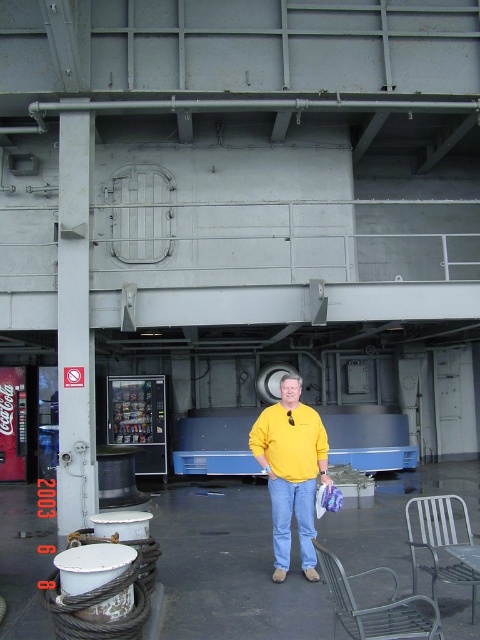
Can you confirm if metallic wire mesh bench at lower right is positioned below blue denim jeans at center?

Incorrect, metallic wire mesh bench at lower right is not positioned below blue denim jeans at center.

Is point (336, 596) in front of point (286, 500)?

Yes.

The width and height of the screenshot is (480, 640). Describe the element at coordinates (375, 605) in the screenshot. I see `metallic wire mesh bench at lower right` at that location.

Where is `metallic wire mesh bench at lower right`? The height and width of the screenshot is (640, 480). metallic wire mesh bench at lower right is located at coordinates (375, 605).

How much distance is there between metallic silver chair at lower right and blue denim jeans at center?

metallic silver chair at lower right and blue denim jeans at center are 3.89 feet apart from each other.

Does metallic silver chair at lower right have a greater height compared to blue denim jeans at center?

No.

At what (x,y) coordinates should I click in order to perform the action: click on metallic silver chair at lower right. Please return your answer as a coordinate pair (x, y). Image resolution: width=480 pixels, height=640 pixels. Looking at the image, I should click on (440, 541).

The width and height of the screenshot is (480, 640). I want to click on metallic silver chair at lower right, so pos(440,541).

Does gray metallic pole at left appear on the right side of metallic wire mesh bench at lower right?

No, gray metallic pole at left is not to the right of metallic wire mesh bench at lower right.

Looking at this image, is gray metallic pole at left below metallic wire mesh bench at lower right?

No.

Find the location of a particular element. The image size is (480, 640). gray metallic pole at left is located at coordinates (74, 323).